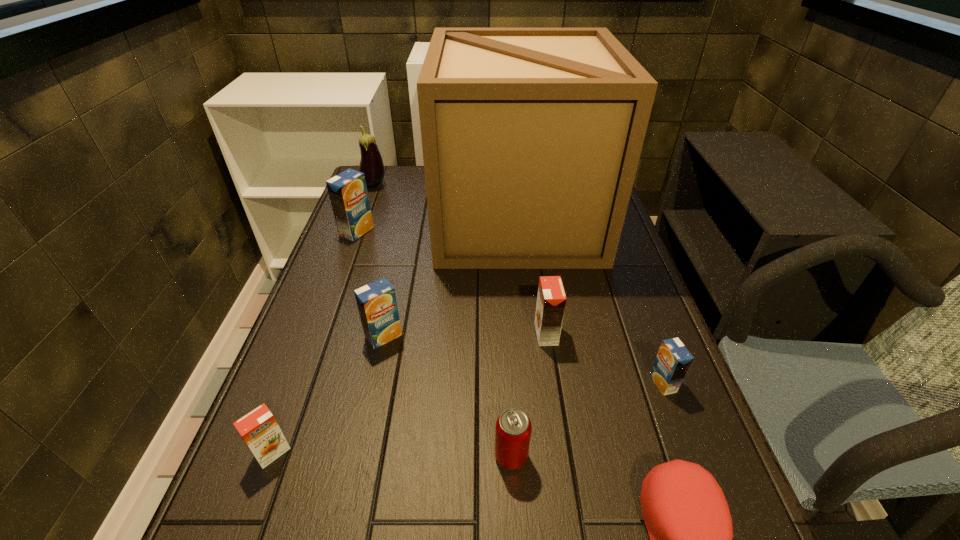
Where is `vacant space located on the right of the can`? The image size is (960, 540). vacant space located on the right of the can is located at coordinates (600, 456).

Locate an element on the screen. The width and height of the screenshot is (960, 540). blank space located 0.150m on the front of the nearest blue orange_juice is located at coordinates (695, 469).

Where is `vacant space located on the right of the nearest orange juice`? This screenshot has height=540, width=960. vacant space located on the right of the nearest orange juice is located at coordinates coord(328,453).

Identify the location of box that is positioned at the far edge. (531, 137).

I want to click on eggplant located at the far edge, so click(371, 164).

This screenshot has height=540, width=960. I want to click on eggplant at the left edge, so click(x=371, y=164).

Find the location of `box located in the right edge section of the desktop`. box located in the right edge section of the desktop is located at coordinates (531, 137).

This screenshot has width=960, height=540. Identify the location of orange_juice situated at the right edge. (673, 360).

You are a GUI agent. You are given a task and a screenshot of the screen. Output one action in this format:
    pyautogui.click(x=<x>, y=<y>)
    Task: Click on the object situated at the far left corner
    
    Given the screenshot: What is the action you would take?
    pyautogui.click(x=371, y=164)

Find the location of a particular element. object that is at the far right corner is located at coordinates (531, 137).